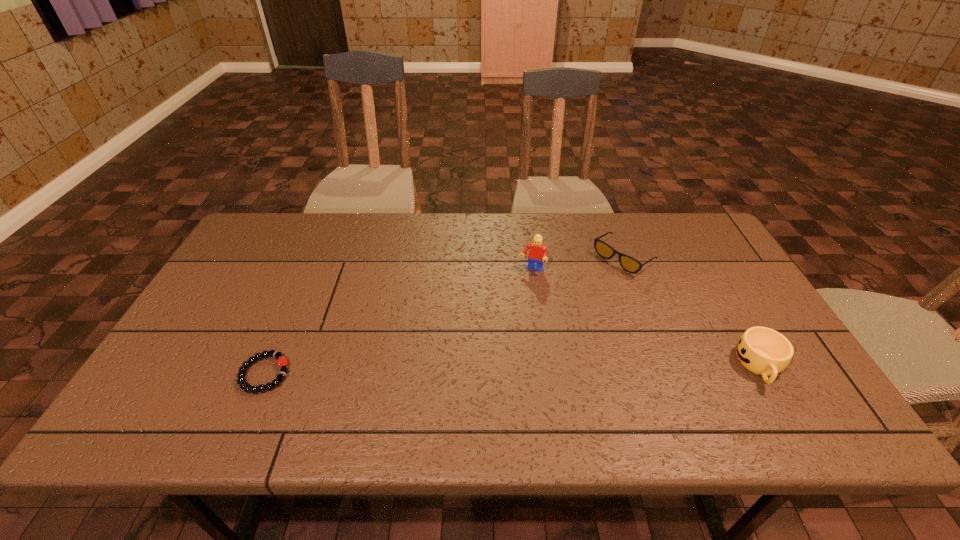
Locate an element on the screen. The width and height of the screenshot is (960, 540). free spot located on the front-facing side of the second object from left to right is located at coordinates (523, 291).

Image resolution: width=960 pixels, height=540 pixels. I want to click on free location located on the front-facing side of the second object from left to right, so click(511, 327).

Where is `free space located on the front-facing side of the third object from left to right`? This screenshot has height=540, width=960. free space located on the front-facing side of the third object from left to right is located at coordinates (544, 316).

Identify the location of free region located 0.370m on the front-facing side of the third object from left to right. (518, 335).

Where is `free space located 0.150m on the front-facing side of the third object from left to right`? This screenshot has width=960, height=540. free space located 0.150m on the front-facing side of the third object from left to right is located at coordinates (573, 295).

At what (x,y) coordinates should I click in order to perform the action: click on object at the far edge. Please return your answer as a coordinate pair (x, y). The width and height of the screenshot is (960, 540). Looking at the image, I should click on 628,263.

The image size is (960, 540). In order to click on bracelet situated at the near edge in this screenshot , I will do `click(282, 361)`.

In order to click on cup that is at the near edge in this screenshot , I will do `click(763, 351)`.

I want to click on object positioned at the right edge, so click(763, 351).

Find the location of a particular element. This screenshot has height=540, width=960. object that is at the near right corner is located at coordinates (763, 351).